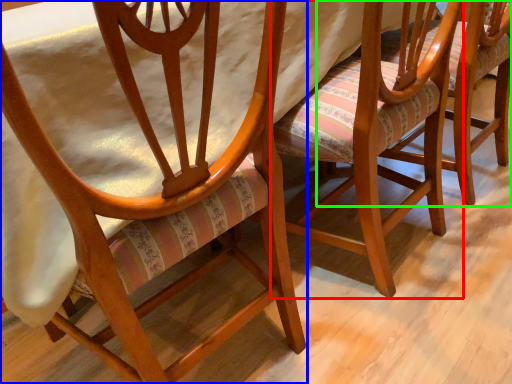
Question: Based on their relative distances, which object is farther from chair (highlighted by a red box)? Choose from chair (highlighted by a blue box) and chair (highlighted by a green box).

Choices:
 (A) chair
 (B) chair

Answer: (A)